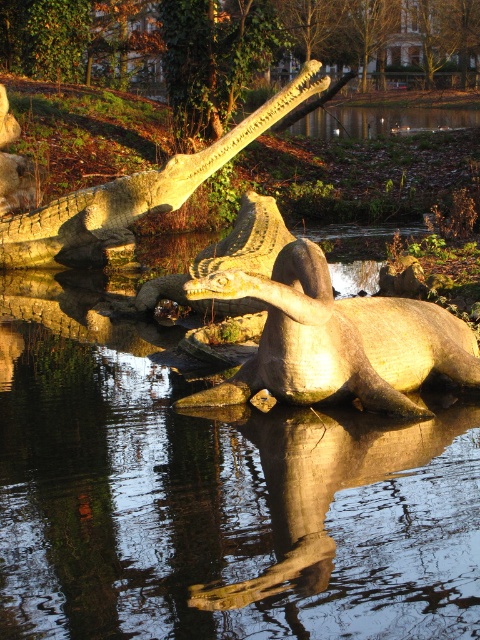
You are standing in the outdoor scene and want to take a photo of the green leafy tree at upper center. Considering the distance, will you need a zoom lens to capture the entire tree in the frame?

The green leafy tree at upper center is 25.67 meters away from you. Since this distance is quite far, you would likely need a zoom lens to ensure the entire tree fits within your camera frame.

You are standing at the edge of the water and see both the green leafy tree at upper center and the matte stone crocodile at upper center. Which object is positioned to the right side from your viewpoint?

The green leafy tree at upper center is positioned to the right of the matte stone crocodile at upper center.

You are an artist planning to paint a scene based on the image. You want to ensure the proportions of the matte stone crocodile at center and the matte stone crocodile at upper center are accurate. Which crocodile should you draw wider in your painting?

The matte stone crocodile at upper center should be drawn wider in your painting since its width is greater than the matte stone crocodile at center.